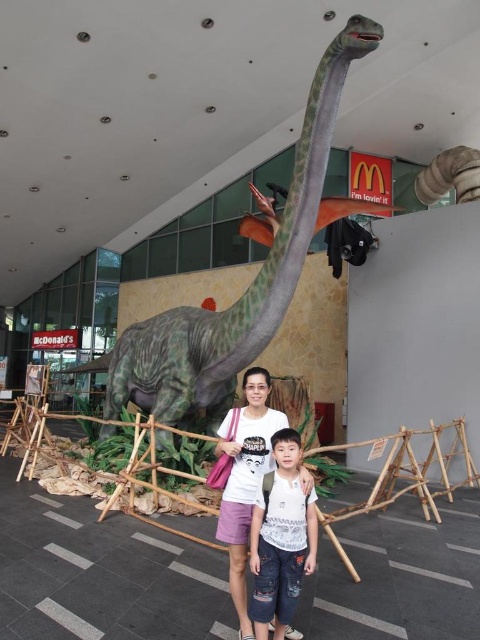
You are a photographer standing in front of the green matte dinosaur at center. You want to take a photo of the dinosaur so that it fills the frame without cropping any part of it. The camera you are using has a focal length of 50mm and a sensor size of 24mm x 36mm. The dinosaur is 4 meters tall. What is the minimum distance you need to be from the dinosaur to capture it entirely in the frame?

The minimum distance required is approximately 4.2 meters. This is calculated by using the formula for the minimum distance to capture an object in frame without cropping, which is sensor height divided by twice the tangent of the focal length. However, since the dinosaur is 4 meters tall and the sensor height is 24mm, the calculation would be 24mm divided by 2 times the tangent of 50mm focal length. The result is approximately 4.2 meters. Since the current distance is 3.51 meters, which is closer than the

You are standing in front of the large dinosaur model and want to move from the point closer to you to the point farther away. Which path would you take between the two points, point 1 at (113, 404) and point 2 at (222, 524)?

You should move from point 1 at (113, 404) to point 2 at (222, 524) because point 1 is closer to you and point 2 is farther away.

Two people are standing in front of the green matte dinosaur at center. How far apart are they from each other?

The two people are 11.52 feet apart from each other.